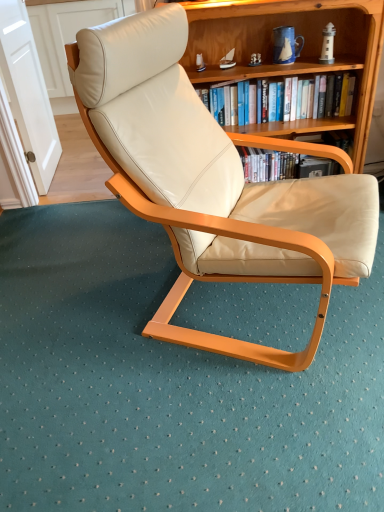
Question: Does wooden bookshelf at upper center turn towards matte cream leather chair at center?

Choices:
 (A) yes
 (B) no

Answer: (A)

Question: Is matte cream leather chair at center a part of wooden bookshelf at upper center?

Choices:
 (A) yes
 (B) no

Answer: (B)

Question: Does wooden bookshelf at upper center have a lesser width compared to matte cream leather chair at center?

Choices:
 (A) no
 (B) yes

Answer: (B)

Question: Can you confirm if wooden bookshelf at upper center is wider than matte cream leather chair at center?

Choices:
 (A) yes
 (B) no

Answer: (B)

Question: Is wooden bookshelf at upper center at the right side of matte cream leather chair at center?

Choices:
 (A) yes
 (B) no

Answer: (A)

Question: Based on their sizes in the image, would you say wooden bookshelf at upper center is bigger or smaller than matte cream leather chair at center?

Choices:
 (A) small
 (B) big

Answer: (A)

Question: Visually, is wooden bookshelf at upper center positioned to the left or to the right of matte cream leather chair at center?

Choices:
 (A) right
 (B) left

Answer: (A)

Question: In terms of width, does wooden bookshelf at upper center look wider or thinner when compared to matte cream leather chair at center?

Choices:
 (A) thin
 (B) wide

Answer: (A)

Question: From their relative heights in the image, would you say wooden bookshelf at upper center is taller or shorter than matte cream leather chair at center?

Choices:
 (A) tall
 (B) short

Answer: (B)

Question: Is point (x=276, y=197) closer or farther from the camera than point (x=314, y=82)?

Choices:
 (A) farther
 (B) closer

Answer: (B)

Question: Based on their sizes in the image, would you say matte cream leather chair at center is bigger or smaller than hardcover book at upper center?

Choices:
 (A) small
 (B) big

Answer: (B)

Question: Choose the correct answer: Is matte cream leather chair at center inside hardcover book at upper center or outside it?

Choices:
 (A) outside
 (B) inside

Answer: (A)

Question: From the image's perspective, is matte cream leather chair at center above or below hardcover book at upper center?

Choices:
 (A) above
 (B) below

Answer: (B)

Question: Considering the positions of hardcover book at upper center and matte cream leather chair at center in the image, is hardcover book at upper center taller or shorter than matte cream leather chair at center?

Choices:
 (A) tall
 (B) short

Answer: (B)

Question: Based on their positions, is hardcover book at upper center located to the left or right of matte cream leather chair at center?

Choices:
 (A) left
 (B) right

Answer: (B)